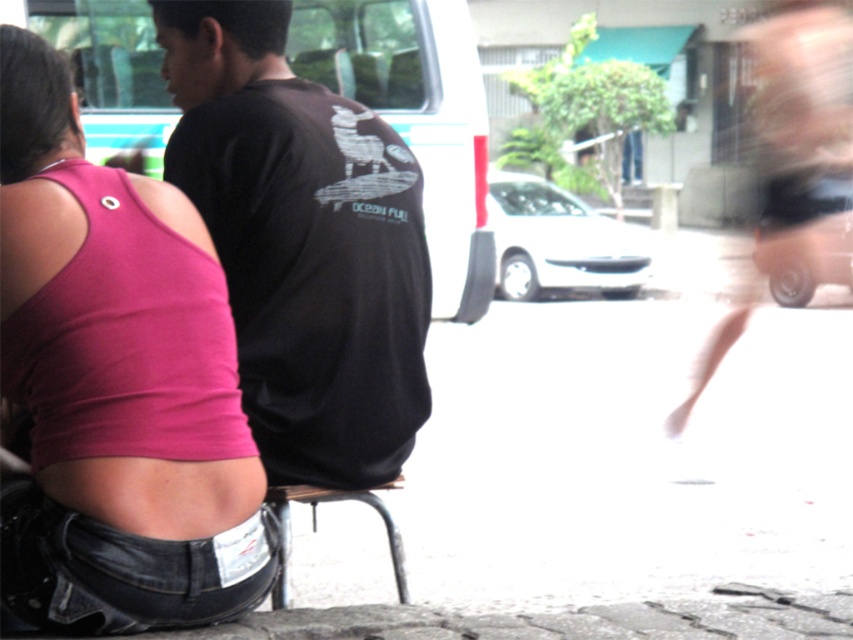
Question: Considering the real-world distances, which object is farthest from the pink fabric tank top at upper left?

Choices:
 (A) black matte t-shirt at upper center
 (B) metallic silver stool at lower center

Answer: (B)

Question: Which object is farther from the camera taking this photo?

Choices:
 (A) black matte t-shirt at upper center
 (B) metallic silver stool at lower center
 (C) pink fabric tank top at upper left

Answer: (A)

Question: Which point is closer to the camera?

Choices:
 (A) (267, 493)
 (B) (61, 618)

Answer: (B)

Question: Does pink fabric tank top at upper left have a larger size compared to metallic silver stool at lower center?

Choices:
 (A) no
 (B) yes

Answer: (B)

Question: Is black matte t-shirt at upper center positioned before metallic silver stool at lower center?

Choices:
 (A) no
 (B) yes

Answer: (A)

Question: Does pink fabric tank top at upper left have a lesser width compared to black matte t-shirt at upper center?

Choices:
 (A) yes
 (B) no

Answer: (A)